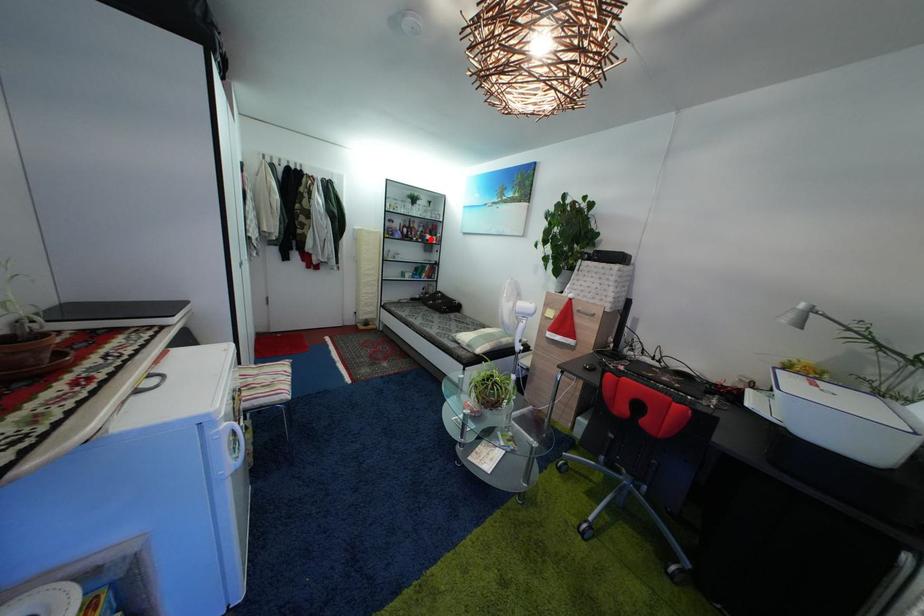
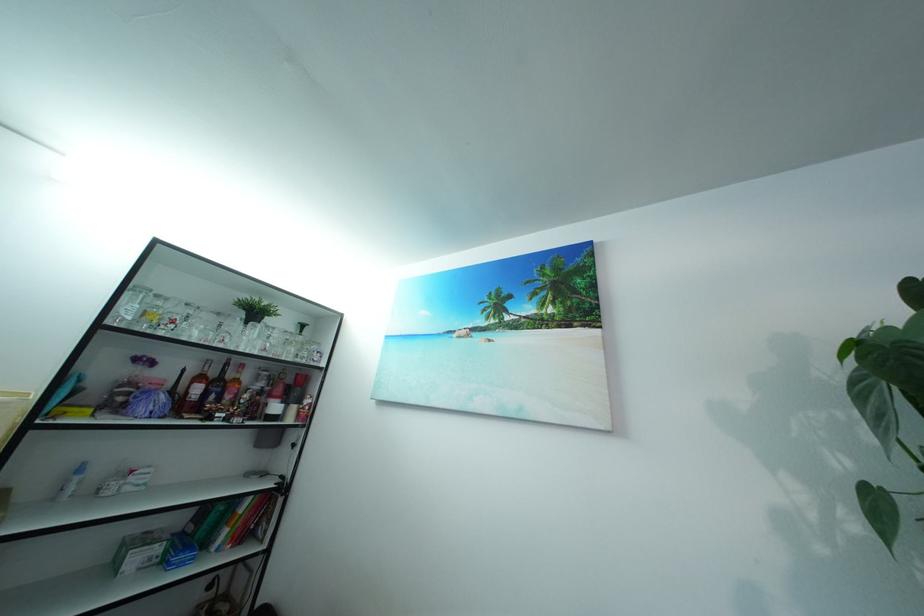
Question: I am providing you with two images of the same scene from different viewpoints. A red point is shown in image1. For the corresponding object point in image2, is it positioned nearer or farther from the camera?

Choices:
 (A) Nearer
 (B) Farther

Answer: (B)